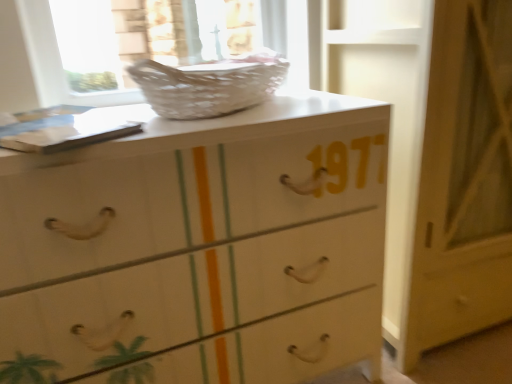
Question: Is white glossy chest of drawers at center taller than white wicker basket at upper center?

Choices:
 (A) no
 (B) yes

Answer: (B)

Question: Is white wicker basket at upper center a part of white glossy chest of drawers at center?

Choices:
 (A) yes
 (B) no

Answer: (B)

Question: Could you tell me if white glossy chest of drawers at center is facing white wicker basket at upper center?

Choices:
 (A) no
 (B) yes

Answer: (A)

Question: Considering the relative positions of white glossy chest of drawers at center and white wicker basket at upper center in the image provided, is white glossy chest of drawers at center in front of white wicker basket at upper center?

Choices:
 (A) no
 (B) yes

Answer: (B)

Question: Is white glossy chest of drawers at center further to camera compared to white wicker basket at upper center?

Choices:
 (A) yes
 (B) no

Answer: (B)

Question: Is white wicker basket at upper center spatially inside white glossy chest of drawers at center, or outside of it?

Choices:
 (A) outside
 (B) inside

Answer: (A)

Question: Is white wicker basket at upper center wider or thinner than white glossy chest of drawers at center?

Choices:
 (A) wide
 (B) thin

Answer: (B)

Question: Considering the positions of white wicker basket at upper center and white glossy chest of drawers at center in the image, is white wicker basket at upper center bigger or smaller than white glossy chest of drawers at center?

Choices:
 (A) small
 (B) big

Answer: (A)

Question: From a real-world perspective, is white wicker basket at upper center positioned above or below white glossy chest of drawers at center?

Choices:
 (A) below
 (B) above

Answer: (B)

Question: Does point pos(145,192) appear closer or farther from the camera than point pos(238,77)?

Choices:
 (A) closer
 (B) farther

Answer: (A)

Question: In terms of size, does white glossy chest of drawers at center appear bigger or smaller than white wicker basket at upper center?

Choices:
 (A) big
 (B) small

Answer: (A)

Question: In terms of width, does white glossy chest of drawers at center look wider or thinner when compared to white wicker basket at upper center?

Choices:
 (A) thin
 (B) wide

Answer: (B)

Question: Considering the positions of white glossy chest of drawers at center and white wicker basket at upper center in the image, is white glossy chest of drawers at center taller or shorter than white wicker basket at upper center?

Choices:
 (A) tall
 (B) short

Answer: (A)

Question: Considering the positions of white wicker basket at upper center and white glossy door at center in the image, is white wicker basket at upper center bigger or smaller than white glossy door at center?

Choices:
 (A) small
 (B) big

Answer: (A)

Question: Considering the positions of point (270, 94) and point (421, 64), is point (270, 94) closer or farther from the camera than point (421, 64)?

Choices:
 (A) farther
 (B) closer

Answer: (A)